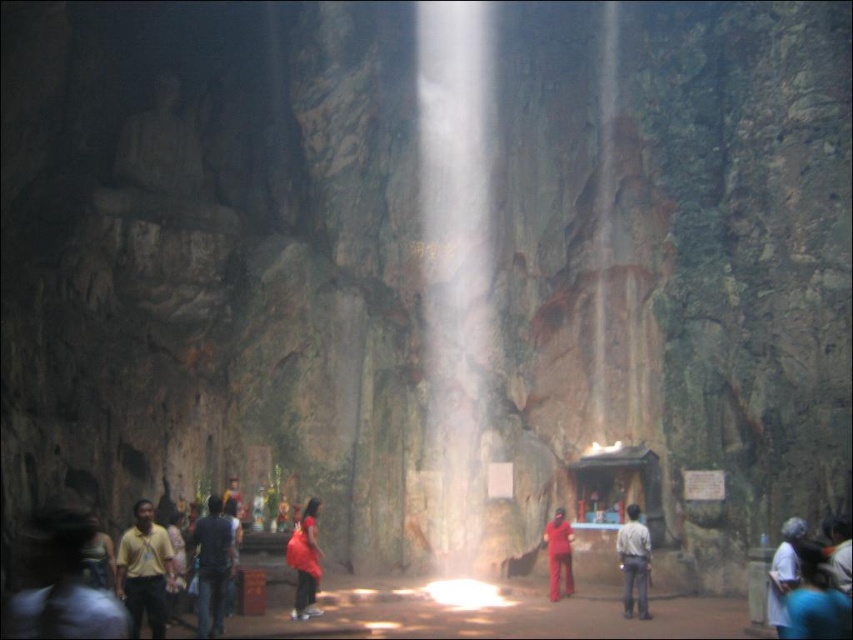
You are an observer in the cavernous interior space. You notice two red garments at the center of the scene. Which one is positioned higher between the matte red dress at center and the matte red pants at center?

The matte red dress at center is positioned higher than the matte red pants at center according to the description.

You are a photographer trying to capture a candid shot of the shrine in the center. You notice the yellow shirt at lower left and dark blue jeans at lower center are in your frame. Since you want to focus on the shrine, which of the two items should you adjust your camera to avoid blocking the shrine?

The yellow shirt at lower left has a larger size compared to dark blue jeans at lower center, so adjusting the camera to avoid the yellow shirt at lower left would be more effective in ensuring the shrine remains unobstructed.

You are standing in the cavernous interior space and notice a yellow shirt at lower left and a matte red pants at center. Which of these two items is shorter in height?

The yellow shirt at lower left is shorter than the matte red pants at center.